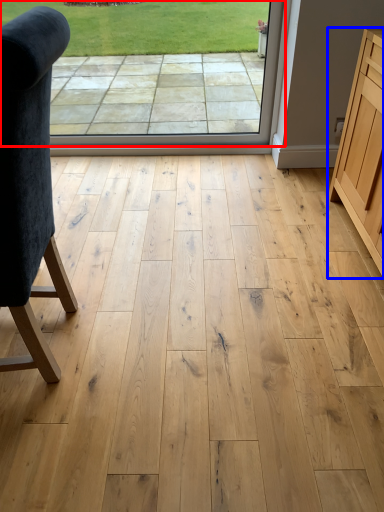
Question: Which object appears closest to the camera in this image, window screen (highlighted by a red box) or cabinetry (highlighted by a blue box)?

Choices:
 (A) window screen
 (B) cabinetry

Answer: (B)